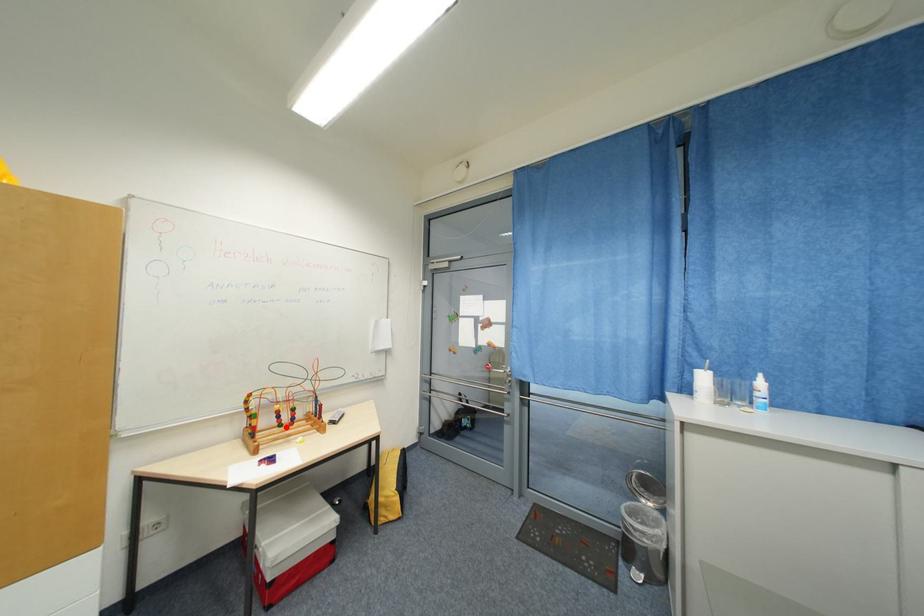
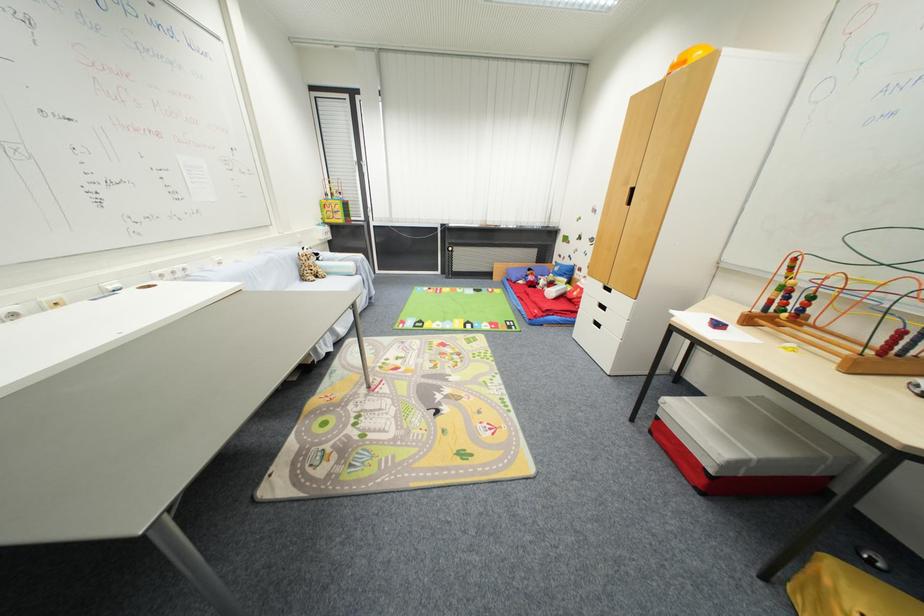
Locate, in the second image, the point that corresponds to the highlighted location in the first image.

(789, 313)